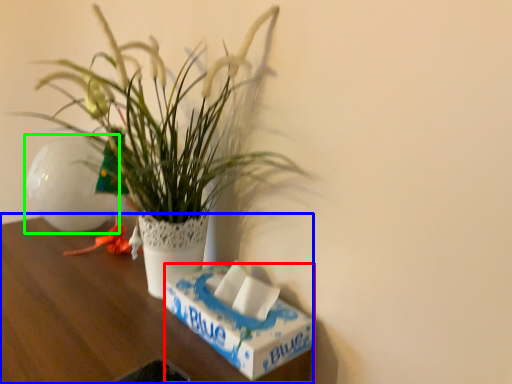
Question: Which is farther away from box (highlighted by a red box)? table (highlighted by a blue box) or flowerpot (highlighted by a green box)?

Choices:
 (A) table
 (B) flowerpot

Answer: (B)